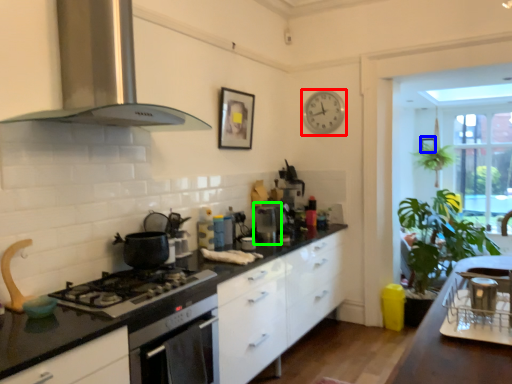
Question: Which is farther away from clock (highlighted by a red box)? picture frame (highlighted by a blue box) or appliance (highlighted by a green box)?

Choices:
 (A) picture frame
 (B) appliance

Answer: (A)